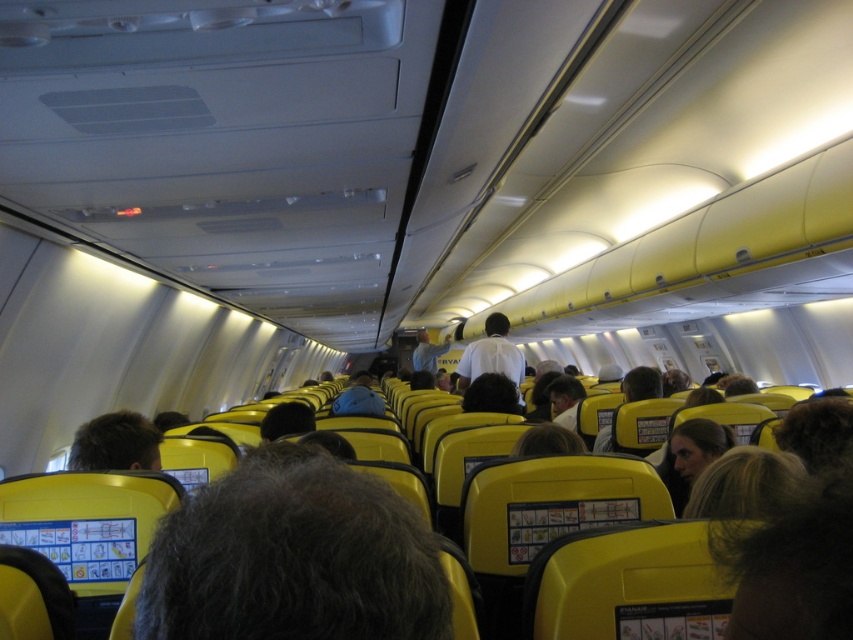
Which is above, dark brown hair at center or white shirt at center?

dark brown hair at center

Does dark brown hair at center come behind white shirt at center?

No, it is not.

The width and height of the screenshot is (853, 640). I want to click on dark brown hair at center, so click(x=115, y=444).

You are a GUI agent. You are given a task and a screenshot of the screen. Output one action in this format:
    pyautogui.click(x=<x>, y=<y>)
    Task: Click on the dark brown hair at center
    
    Given the screenshot: What is the action you would take?
    pyautogui.click(x=115, y=444)